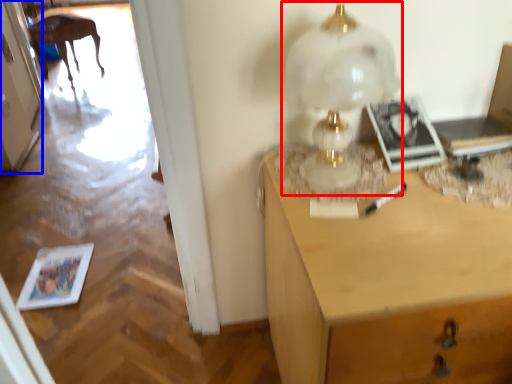
Question: Among these objects, which one is nearest to the camera, table lamp (highlighted by a red box) or door (highlighted by a blue box)?

Choices:
 (A) table lamp
 (B) door

Answer: (A)